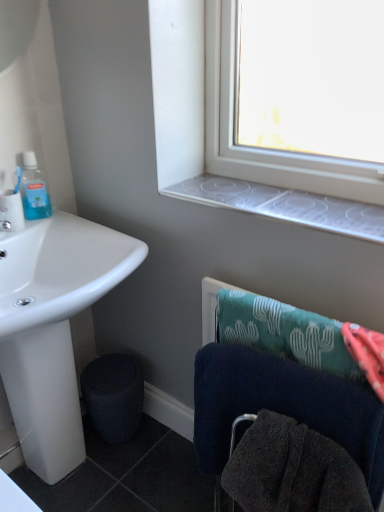
Locate an element on the screen. Image resolution: width=384 pixels, height=512 pixels. free space above black matte trash bin/can at lower left (from a real-world perspective) is located at coordinates (111, 374).